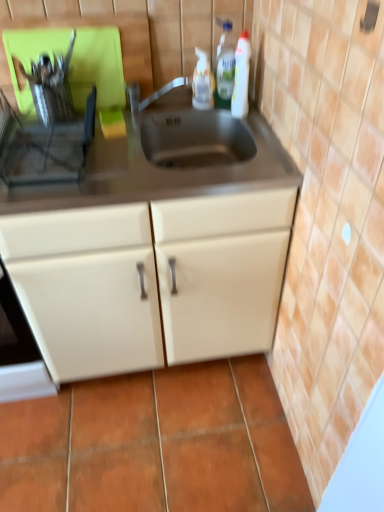
What do you see at coordinates (47, 149) in the screenshot?
I see `metallic silver dish rack at left` at bounding box center [47, 149].

Find the location of a particular element. The width and height of the screenshot is (384, 512). white plastic bottle at upper right, which ranks as the 1th bottle in right-to-left order is located at coordinates (241, 76).

The height and width of the screenshot is (512, 384). What do you see at coordinates (87, 288) in the screenshot? I see `matte cream cabinet at center` at bounding box center [87, 288].

Measure the distance between point (199, 57) and camera.

Point (199, 57) is 4.78 feet from camera.

This screenshot has width=384, height=512. I want to click on metallic silver dish rack at left, so click(x=47, y=149).

Who is shorter, matte cream cabinet at center or translucent plastic spray bottle at upper center, the 3th bottle from the right?

Standing shorter between the two is translucent plastic spray bottle at upper center, the 3th bottle from the right.

Is matte cream cabinet at center next to translucent plastic spray bottle at upper center, the first bottle viewed from the left, and touching it?

No, matte cream cabinet at center is not with translucent plastic spray bottle at upper center, the first bottle viewed from the left.

Is matte cream cabinet at center facing towards translucent plastic spray bottle at upper center, the 3th bottle from the right?

No.

Is matte cream cabinet at center bigger than translucent plastic spray bottle at upper center, the first bottle viewed from the left?

Yes.

Between point (234, 102) and point (177, 82), which one is positioned in front?

Positioned in front is point (234, 102).

Considering the sizes of objects white plastic bottle at upper right, the third bottle viewed from the left, and satin nickel faucet at center in the image provided, who is smaller, white plastic bottle at upper right, the third bottle viewed from the left, or satin nickel faucet at center?

With smaller size is white plastic bottle at upper right, the third bottle viewed from the left.

Is white plastic bottle at upper right, the third bottle viewed from the left, beside satin nickel faucet at center?

No, white plastic bottle at upper right, the third bottle viewed from the left, is not touching satin nickel faucet at center.

Is white plastic bottle at upper right, which ranks as the 1th bottle in right-to-left order, oriented towards satin nickel faucet at center?

No, white plastic bottle at upper right, which ranks as the 1th bottle in right-to-left order, does not turn towards satin nickel faucet at center.

Are satin nickel faucet at center and translucent plastic spray bottle at upper center, the first bottle viewed from the left, located far from each other?

That's not correct — satin nickel faucet at center is a little close to translucent plastic spray bottle at upper center, the first bottle viewed from the left.

Could you tell me if satin nickel faucet at center is turned towards translucent plastic spray bottle at upper center, the first bottle viewed from the left?

No, satin nickel faucet at center is not aimed at translucent plastic spray bottle at upper center, the first bottle viewed from the left.

From the image's perspective, which is below, satin nickel faucet at center or translucent plastic spray bottle at upper center, the 3th bottle from the right?

satin nickel faucet at center is shown below in the image.

Considering the relative sizes of white plastic bottle at upper right, which ranks as the 1th bottle in right-to-left order, and metallic silver dish rack at left in the image provided, is white plastic bottle at upper right, which ranks as the 1th bottle in right-to-left order, smaller than metallic silver dish rack at left?

Yes.

Would you say white plastic bottle at upper right, the third bottle viewed from the left, is to the left or to the right of metallic silver dish rack at left in the picture?

From the image, it's evident that white plastic bottle at upper right, the third bottle viewed from the left, is to the right of metallic silver dish rack at left.

Is white plastic bottle at upper right, the third bottle viewed from the left, oriented away from metallic silver dish rack at left?

white plastic bottle at upper right, the third bottle viewed from the left, does not have its back to metallic silver dish rack at left.

Which object is positioned more to the right, translucent plastic bottle at upper right, marked as the second bottle in a right-to-left arrangement, or metallic silver dish rack at left?

Positioned to the right is translucent plastic bottle at upper right, marked as the second bottle in a right-to-left arrangement.

Where is `the 3rd bottle positioned above the metallic silver dish rack at left (from a real-world perspective)`? This screenshot has width=384, height=512. the 3rd bottle positioned above the metallic silver dish rack at left (from a real-world perspective) is located at coordinates (225, 65).

From the picture: Is translucent plastic bottle at upper right, marked as the 2th bottle in a left-to-right arrangement, oriented away from metallic silver dish rack at left?

That's not correct — translucent plastic bottle at upper right, marked as the 2th bottle in a left-to-right arrangement, is not looking away from metallic silver dish rack at left.

Can you confirm if metallic silver dish rack at left is positioned to the right of translucent plastic bottle at upper right, marked as the second bottle in a right-to-left arrangement?

No.

Which is farther from the camera, (39, 158) or (233, 40)?

The point (233, 40) is behind.

How different are the orientations of metallic silver dish rack at left and translucent plastic bottle at upper right, marked as the second bottle in a right-to-left arrangement, in degrees?

They differ by 0.00016 degrees in their facing directions.

Considering the sizes of objects metallic silver dish rack at left and translucent plastic bottle at upper right, marked as the 2th bottle in a left-to-right arrangement, in the image provided, who is taller, metallic silver dish rack at left or translucent plastic bottle at upper right, marked as the 2th bottle in a left-to-right arrangement,?

With more height is translucent plastic bottle at upper right, marked as the 2th bottle in a left-to-right arrangement.

From a real-world perspective, is translucent plastic bottle at upper right, marked as the second bottle in a right-to-left arrangement, positioned above or below satin nickel faucet at center?

translucent plastic bottle at upper right, marked as the second bottle in a right-to-left arrangement, is situated higher than satin nickel faucet at center in the real world.

In the scene shown: Is translucent plastic bottle at upper right, marked as the second bottle in a right-to-left arrangement, inside the boundaries of satin nickel faucet at center, or outside?

The correct answer is: outside.

Considering the relative sizes of translucent plastic bottle at upper right, marked as the 2th bottle in a left-to-right arrangement, and satin nickel faucet at center in the image provided, is translucent plastic bottle at upper right, marked as the 2th bottle in a left-to-right arrangement, taller than satin nickel faucet at center?

Indeed, translucent plastic bottle at upper right, marked as the 2th bottle in a left-to-right arrangement, has a greater height compared to satin nickel faucet at center.

Identify the location of the 1st bottle located above the matte cream cabinet at center (from a real-world perspective). (203, 82).

Where is `bottle in front of the satin nickel faucet at center`? This screenshot has height=512, width=384. bottle in front of the satin nickel faucet at center is located at coordinates (241, 76).

Estimate the real-world distances between objects in this image. Which object is closer to metallic silver dish rack at left, white plastic bottle at upper right, which ranks as the 1th bottle in right-to-left order, or matte cream cabinet at center?

Among the two, matte cream cabinet at center is located nearer to metallic silver dish rack at left.

Which object lies nearer to the anchor point translucent plastic spray bottle at upper center, the 3th bottle from the right, satin nickel faucet at center or matte cream cabinet at center?

satin nickel faucet at center lies closer to translucent plastic spray bottle at upper center, the 3th bottle from the right, than the other object.

Considering their positions, is metallic silver dish rack at left positioned further to white plastic bottle at upper right, which ranks as the 1th bottle in right-to-left order, than translucent plastic bottle at upper right, marked as the 2th bottle in a left-to-right arrangement?

metallic silver dish rack at left is further to white plastic bottle at upper right, which ranks as the 1th bottle in right-to-left order.

Considering their positions, is matte cream cabinet at center positioned closer to white plastic bottle at upper right, the third bottle viewed from the left, than metallic silver dish rack at left?

metallic silver dish rack at left.

Considering their positions, is translucent plastic spray bottle at upper center, the first bottle viewed from the left, positioned further to metallic silver dish rack at left than translucent plastic bottle at upper right, marked as the second bottle in a right-to-left arrangement?

translucent plastic bottle at upper right, marked as the second bottle in a right-to-left arrangement, lies further to metallic silver dish rack at left than the other object.

Which object lies nearer to the anchor point translucent plastic spray bottle at upper center, the 3th bottle from the right, white plastic bottle at upper right, which ranks as the 1th bottle in right-to-left order, or metallic silver dish rack at left?

The object closer to translucent plastic spray bottle at upper center, the 3th bottle from the right, is white plastic bottle at upper right, which ranks as the 1th bottle in right-to-left order.

When comparing their distances from satin nickel faucet at center, does translucent plastic bottle at upper right, marked as the second bottle in a right-to-left arrangement, or matte cream cabinet at center seem closer?

translucent plastic bottle at upper right, marked as the second bottle in a right-to-left arrangement.

Based on their spatial positions, is matte cream cabinet at center or translucent plastic spray bottle at upper center, the first bottle viewed from the left, closer to satin nickel faucet at center?

The object closer to satin nickel faucet at center is translucent plastic spray bottle at upper center, the first bottle viewed from the left.

At what (x,y) coordinates should I click in order to perform the action: click on faucet between translucent plastic spray bottle at upper center, the 3th bottle from the right, and matte cream cabinet at center vertically. Please return your answer as a coordinate pair (x, y). The width and height of the screenshot is (384, 512). Looking at the image, I should click on (153, 93).

At what (x,y) coordinates should I click in order to perform the action: click on bottle between translucent plastic spray bottle at upper center, the 3th bottle from the right, and white plastic bottle at upper right, the third bottle viewed from the left, in the horizontal direction. Please return your answer as a coordinate pair (x, y). Image resolution: width=384 pixels, height=512 pixels. Looking at the image, I should click on (225, 65).

Find the location of a particular element. Image resolution: width=384 pixels, height=512 pixels. bottle situated between metallic silver dish rack at left and translucent plastic bottle at upper right, marked as the second bottle in a right-to-left arrangement, from left to right is located at coordinates [203, 82].

Image resolution: width=384 pixels, height=512 pixels. Find the location of `faucet between metallic silver dish rack at left and translucent plastic bottle at upper right, marked as the second bottle in a right-to-left arrangement, in the horizontal direction`. faucet between metallic silver dish rack at left and translucent plastic bottle at upper right, marked as the second bottle in a right-to-left arrangement, in the horizontal direction is located at coordinates (153, 93).